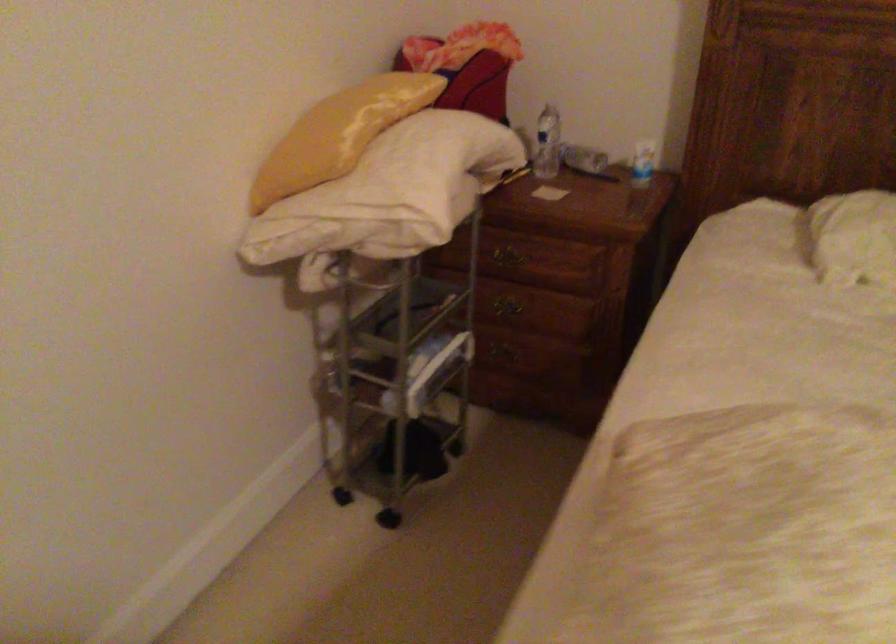
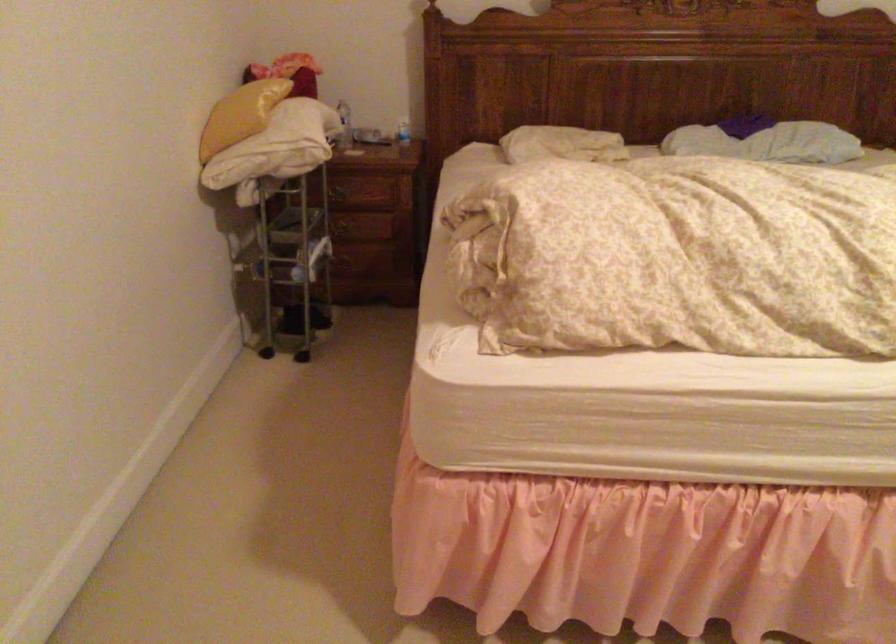
The point at (518, 160) is marked in the first image. Where is the corresponding point in the second image?

(343, 125)